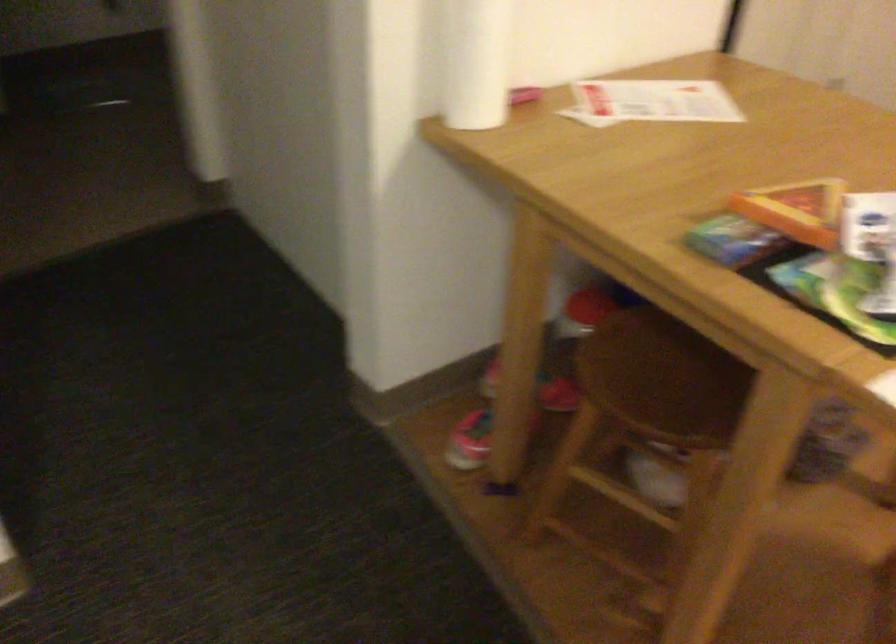
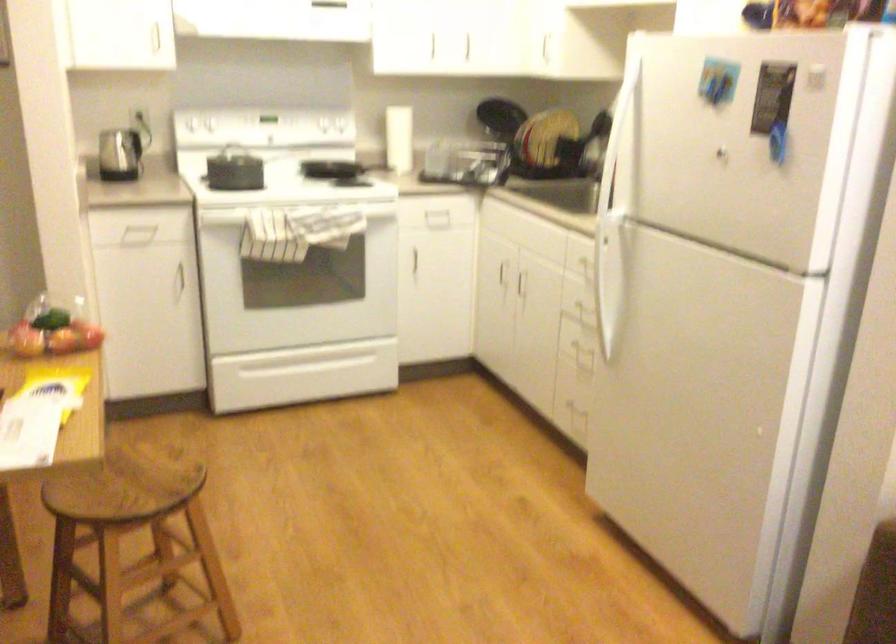
Question: Based on the continuous images, in which direction is the camera rotating? Reply with the corresponding letter.

Choices:
 (A) Left
 (B) Right
 (C) Up
 (D) Down

Answer: (B)